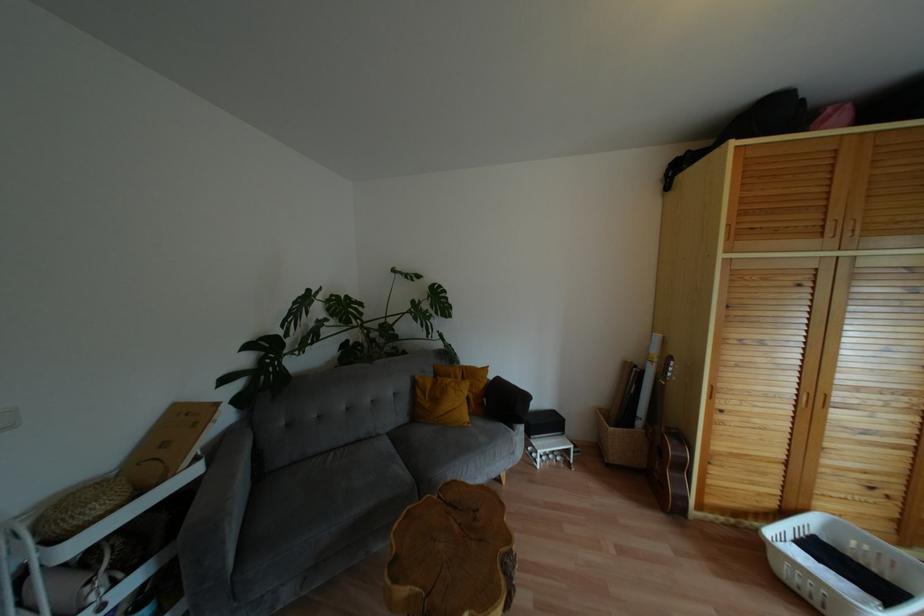
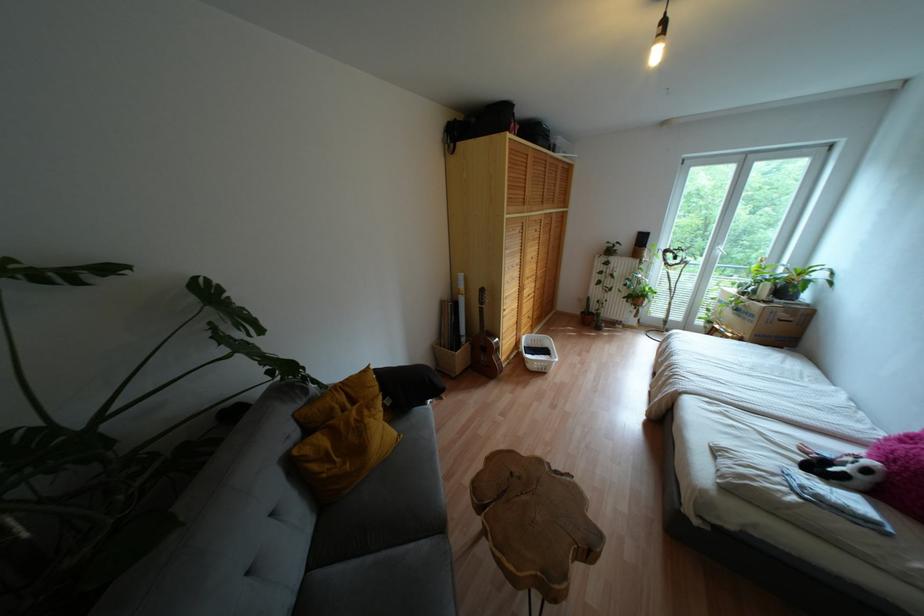
The point at (x=423, y=391) is marked in the first image. Where is the corresponding point in the second image?

(325, 458)